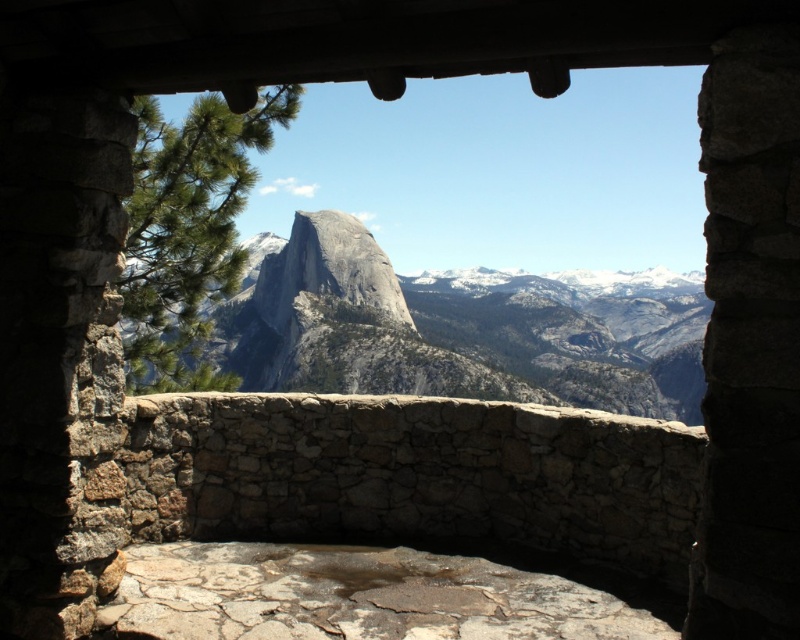
Question: Is gray/granite mountain at center positioned in front of green textured pine at left?

Choices:
 (A) yes
 (B) no

Answer: (B)

Question: Which point is closer to the camera?

Choices:
 (A) (186, 218)
 (B) (276, 378)

Answer: (A)

Question: Which of the following is the closest to the observer?

Choices:
 (A) gray/granite mountain at center
 (B) green textured pine at left

Answer: (B)

Question: From the image, what is the correct spatial relationship of gray/granite mountain at center in relation to green textured pine at left?

Choices:
 (A) above
 (B) below

Answer: (A)

Question: Is gray/granite mountain at center to the left of green textured pine at left from the viewer's perspective?

Choices:
 (A) yes
 (B) no

Answer: (B)